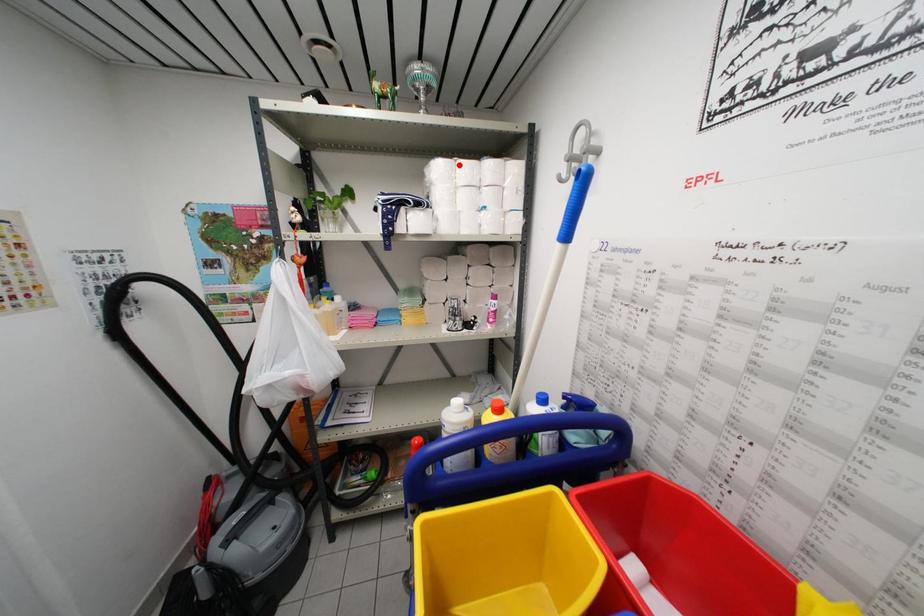
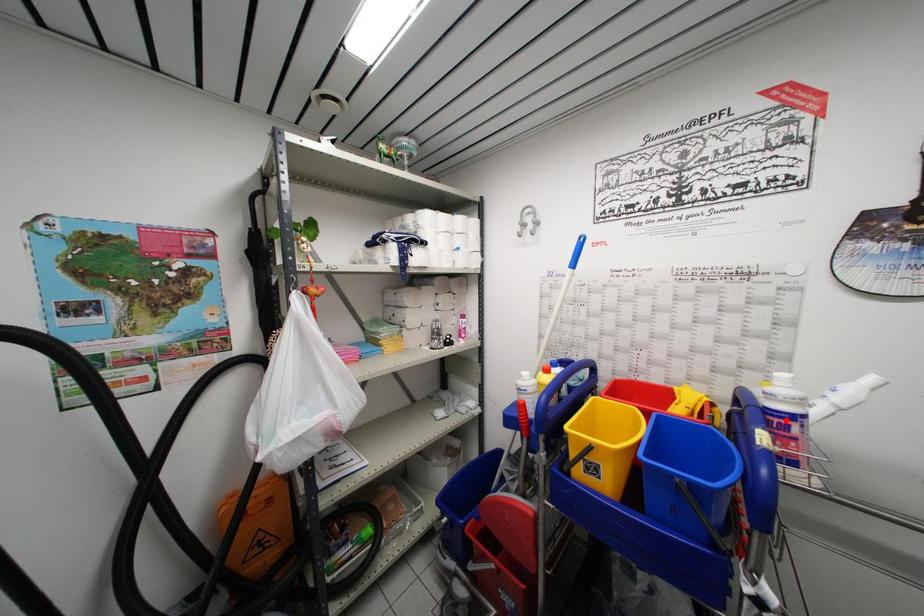
I am providing you with two images of the same scene from different viewpoints. A red point is marked on the first image and another point is marked on the second image. Does the point marked in image1 correspond to the same location as the one in image2?

No